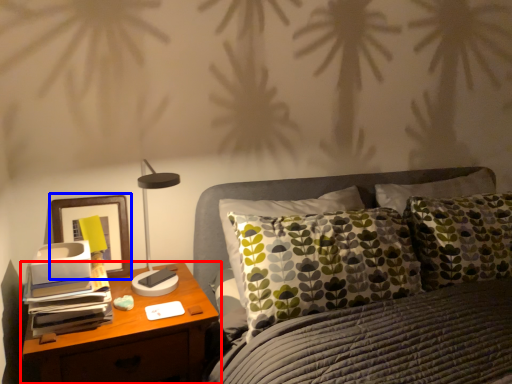
Question: Which of the following is the closest to the observer, nightstand (highlighted by a red box) or picture frame (highlighted by a blue box)?

Choices:
 (A) nightstand
 (B) picture frame

Answer: (A)